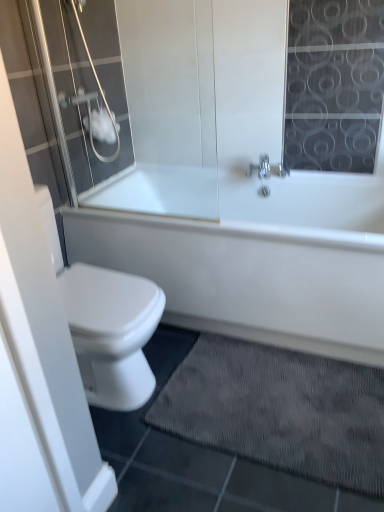
Question: Should I look upward or downward to see transparent glass shower door at upper left?

Choices:
 (A) down
 (B) up

Answer: (B)

Question: Is dark gray textured bath mat at lower center surrounding white matte toilet paper at upper left?

Choices:
 (A) no
 (B) yes

Answer: (A)

Question: Does dark gray textured bath mat at lower center appear on the left side of white matte toilet paper at upper left?

Choices:
 (A) no
 (B) yes

Answer: (A)

Question: From the image's perspective, is dark gray textured bath mat at lower center on top of white matte toilet paper at upper left?

Choices:
 (A) no
 (B) yes

Answer: (A)

Question: Considering the relative sizes of dark gray textured bath mat at lower center and white matte toilet paper at upper left in the image provided, is dark gray textured bath mat at lower center thinner than white matte toilet paper at upper left?

Choices:
 (A) no
 (B) yes

Answer: (A)

Question: Can you confirm if dark gray textured bath mat at lower center is wider than white matte toilet paper at upper left?

Choices:
 (A) no
 (B) yes

Answer: (B)

Question: Is dark gray textured bath mat at lower center positioned before white matte toilet paper at upper left?

Choices:
 (A) yes
 (B) no

Answer: (A)

Question: Is dark gray textured bath mat at lower center at the right side of transparent glass shower door at upper left?

Choices:
 (A) no
 (B) yes

Answer: (B)

Question: Is dark gray textured bath mat at lower center not within transparent glass shower door at upper left?

Choices:
 (A) yes
 (B) no

Answer: (A)

Question: From a real-world perspective, is dark gray textured bath mat at lower center under transparent glass shower door at upper left?

Choices:
 (A) yes
 (B) no

Answer: (A)

Question: Can you confirm if dark gray textured bath mat at lower center is positioned to the left of transparent glass shower door at upper left?

Choices:
 (A) yes
 (B) no

Answer: (B)

Question: From a real-world perspective, is dark gray textured bath mat at lower center over transparent glass shower door at upper left?

Choices:
 (A) no
 (B) yes

Answer: (A)

Question: Considering the relative sizes of dark gray textured bath mat at lower center and transparent glass shower door at upper left in the image provided, is dark gray textured bath mat at lower center shorter than transparent glass shower door at upper left?

Choices:
 (A) no
 (B) yes

Answer: (B)

Question: Does white glossy bathtub at center have a greater width compared to transparent glass shower door at upper left?

Choices:
 (A) yes
 (B) no

Answer: (A)